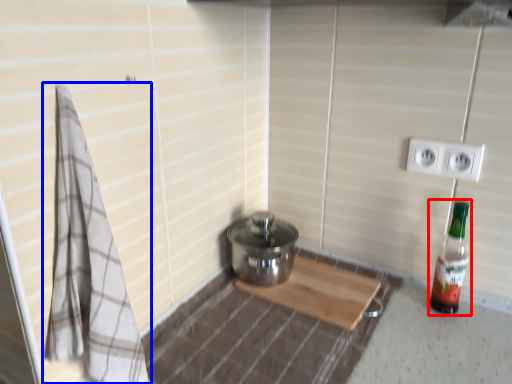
Question: Among these objects, which one is nearest to the camera, bottle (highlighted by a red box) or bath towel (highlighted by a blue box)?

Choices:
 (A) bottle
 (B) bath towel

Answer: (B)